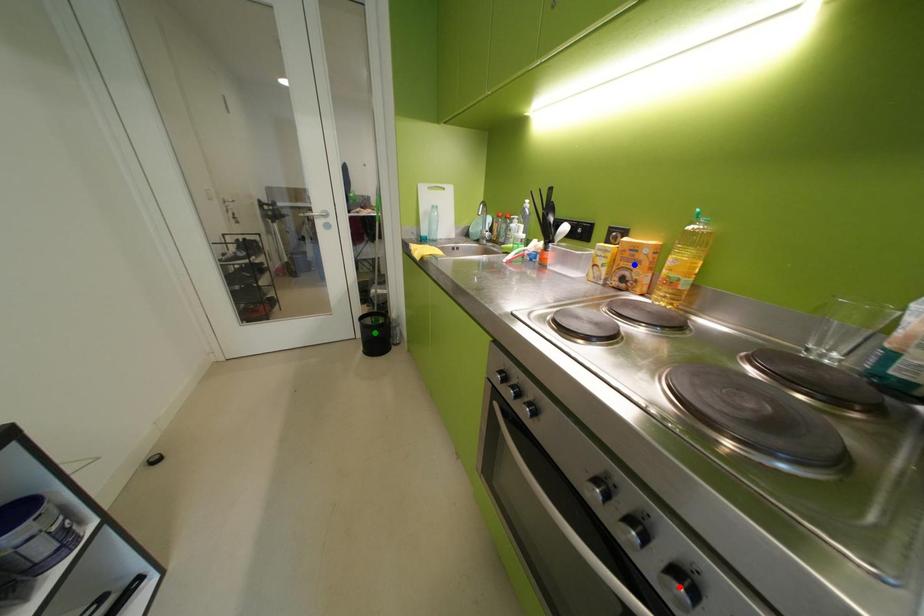
Order these from nearest to farthest:
red point | green point | blue point

red point, blue point, green point